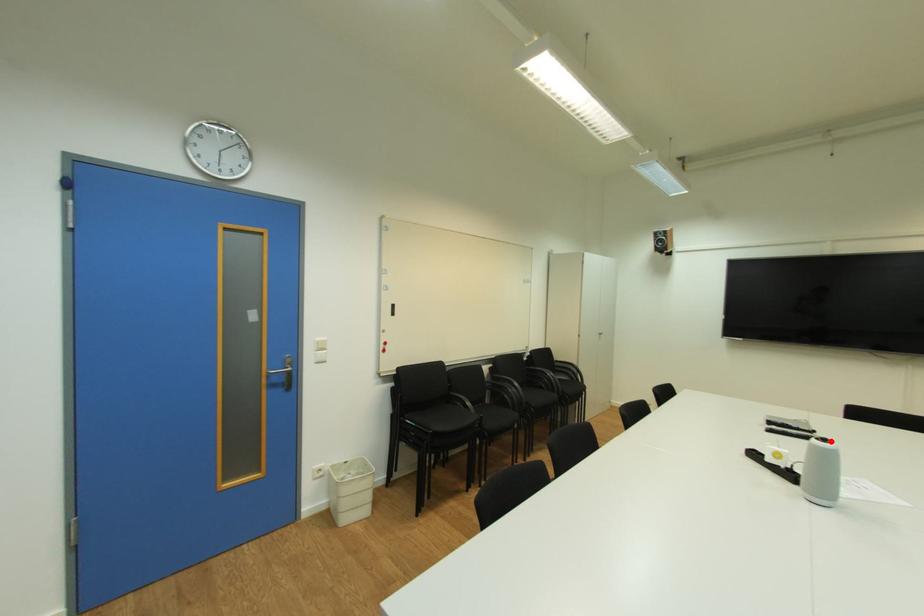
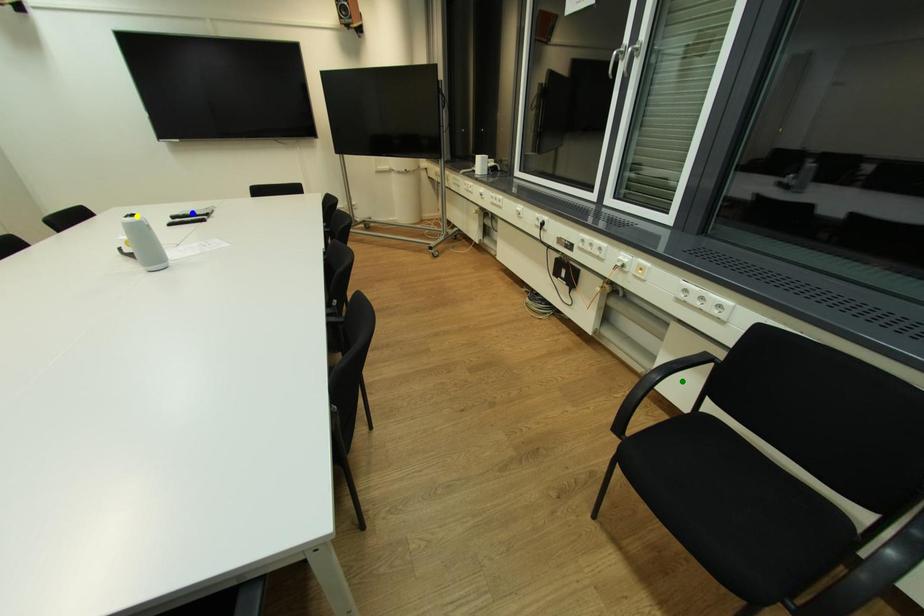
Question: I am providing you with two images of the same scene from different viewpoints. A red point is marked on the first image. You are given multiple points on the second image. Which point in image 2 represents the same 3d spot as the red point in image 1?

Choices:
 (A) yellow point
 (B) green point
 (C) blue point

Answer: (A)